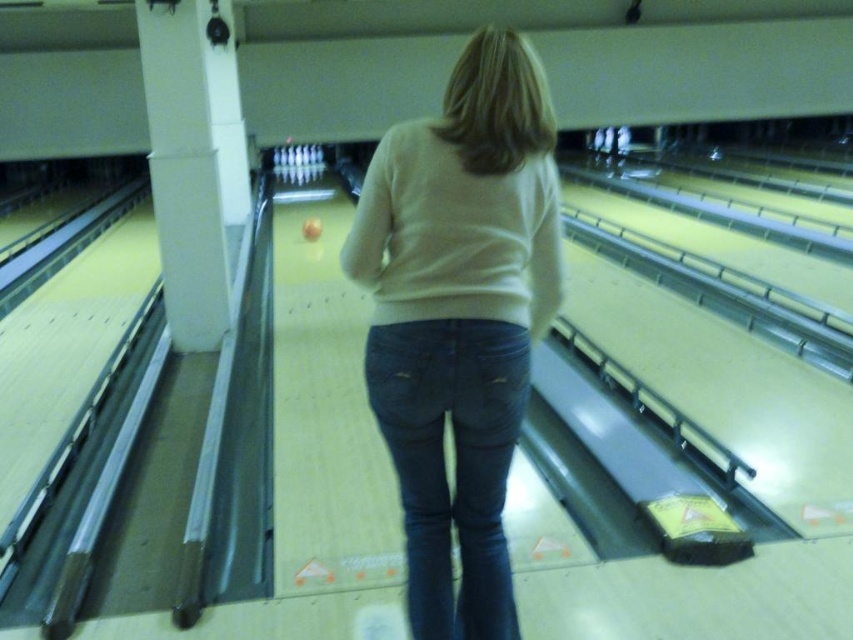
Between light beige sweater at center and dark blue denim jeans at center, which one has less height?

Standing shorter between the two is dark blue denim jeans at center.

Does point (523, 113) come in front of point (486, 444)?

Yes.

Identify the location of light beige sweater at center. Image resolution: width=853 pixels, height=640 pixels. click(x=459, y=317).